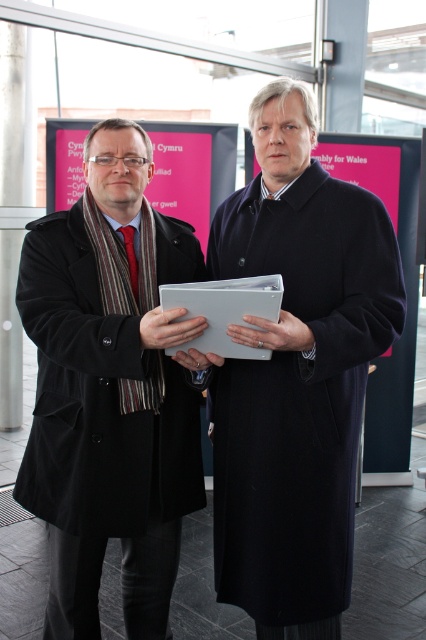
You are a security guard checking the size of items in a restricted area. The restricted area has a rule that items wider than 30 cm cannot be brought in. You see a dark wool coat at center and a matte gray folder at center. Which item is more likely to exceed the width limit?

The dark wool coat at center is wider than the matte gray folder at center, so the dark wool coat at center is more likely to exceed the 30 cm width limit.

Consider the image. You are a security guard in a corporate office. You see the black matte coat at left and the matte gray folder at center. Which object is positioned to the right of the other?

The matte gray folder at center is to the right of the black matte coat at left.

You are a security guard in a gallery and need to check the coats of two visitors. The visitors are wearing a dark wool coat at center and a black matte coat at left. Which coat should you check first if you follow the rule of checking the one closest to the entrance?

The dark wool coat at center is in front of the black matte coat at left, so it is closer to the entrance. Therefore, you should check the dark wool coat at center first.